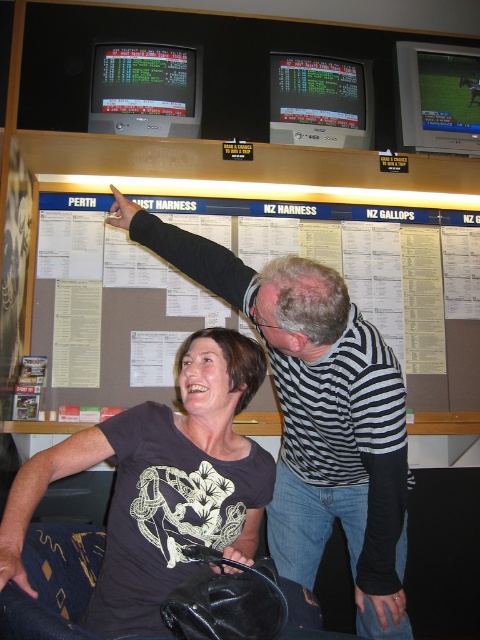
Question: Is striped shirt at upper center to the right of dark gray matte shirt at center from the viewer's perspective?

Choices:
 (A) no
 (B) yes

Answer: (B)

Question: Is striped shirt at upper center bigger than white paperboard at upper center?

Choices:
 (A) yes
 (B) no

Answer: (B)

Question: Which point is closer to the camera taking this photo?

Choices:
 (A) (251, 561)
 (B) (255, 401)
 (C) (216, 269)

Answer: (A)

Question: Which object is the farthest from the white paperboard at upper center?

Choices:
 (A) dark gray matte shirt at center
 (B) striped shirt at upper center

Answer: (A)

Question: Is dark gray matte shirt at center to the left of white paperboard at upper center from the viewer's perspective?

Choices:
 (A) no
 (B) yes

Answer: (B)

Question: Which point is closer to the camera?

Choices:
 (A) pyautogui.click(x=298, y=513)
 (B) pyautogui.click(x=432, y=348)
 (C) pyautogui.click(x=243, y=544)

Answer: (C)